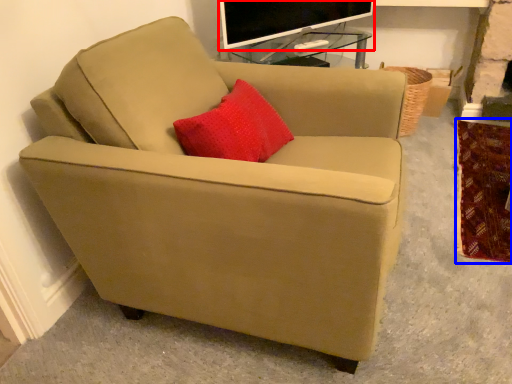
Question: Which object appears farthest to the camera in this image, television (highlighted by a red box) or blanket (highlighted by a blue box)?

Choices:
 (A) television
 (B) blanket

Answer: (A)